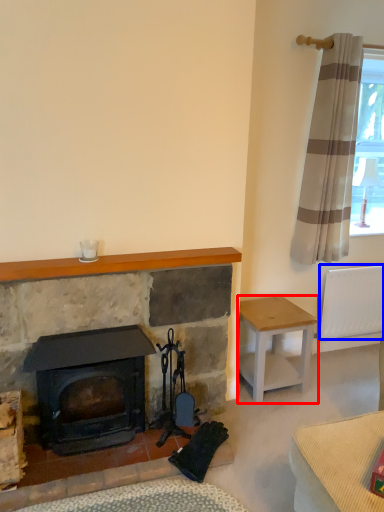
Question: Among these objects, which one is farthest to the camera, stool (highlighted by a red box) or radiator (highlighted by a blue box)?

Choices:
 (A) stool
 (B) radiator

Answer: (B)